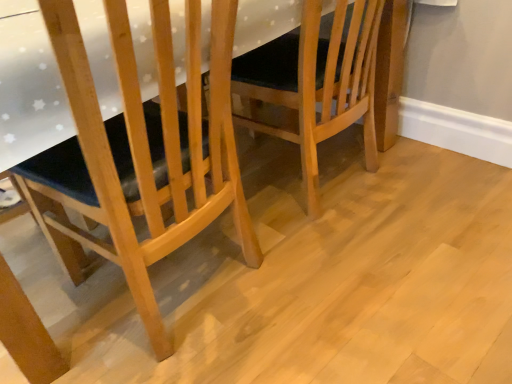
The height and width of the screenshot is (384, 512). Find the location of `vacant space to the right of natural wood chair at left, acting as the 1th chair starting from the left`. vacant space to the right of natural wood chair at left, acting as the 1th chair starting from the left is located at coordinates [x=366, y=286].